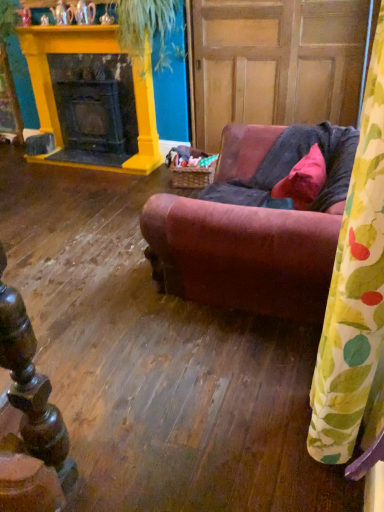
Question: Does green leafy plant at upper center turn towards leather couch at center?

Choices:
 (A) yes
 (B) no

Answer: (B)

Question: Can you confirm if green leafy plant at upper center is positioned to the right of leather couch at center?

Choices:
 (A) yes
 (B) no

Answer: (B)

Question: Is green leafy plant at upper center behind leather couch at center?

Choices:
 (A) no
 (B) yes

Answer: (B)

Question: From the image's perspective, is green leafy plant at upper center on leather couch at center?

Choices:
 (A) yes
 (B) no

Answer: (A)

Question: From the image's perspective, would you say green leafy plant at upper center is shown under leather couch at center?

Choices:
 (A) yes
 (B) no

Answer: (B)

Question: Is green leafy plant at upper center to the left of leather couch at center from the viewer's perspective?

Choices:
 (A) no
 (B) yes

Answer: (B)

Question: Does wooden paneling at center have a smaller size compared to leather couch at center?

Choices:
 (A) no
 (B) yes

Answer: (A)

Question: Is wooden paneling at center not close to leather couch at center?

Choices:
 (A) no
 (B) yes

Answer: (B)

Question: From a real-world perspective, is wooden paneling at center below leather couch at center?

Choices:
 (A) no
 (B) yes

Answer: (A)

Question: Is wooden paneling at center in contact with leather couch at center?

Choices:
 (A) no
 (B) yes

Answer: (A)

Question: Can leather couch at center be found inside wooden paneling at center?

Choices:
 (A) no
 (B) yes

Answer: (A)

Question: Is wooden paneling at center bigger than leather couch at center?

Choices:
 (A) yes
 (B) no

Answer: (A)

Question: Does matte pink fabric pillow at center have a larger size compared to leather couch at center?

Choices:
 (A) yes
 (B) no

Answer: (B)